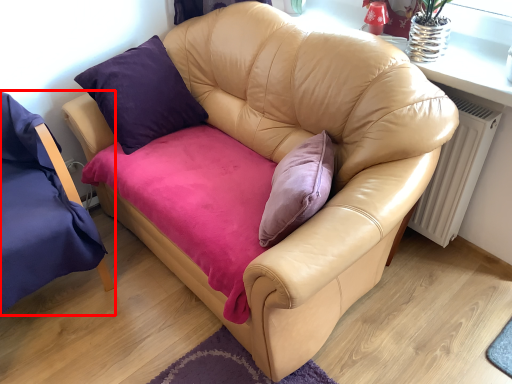
Question: In this image, where is chair (annotated by the red box) located relative to radiator?

Choices:
 (A) right
 (B) left

Answer: (B)